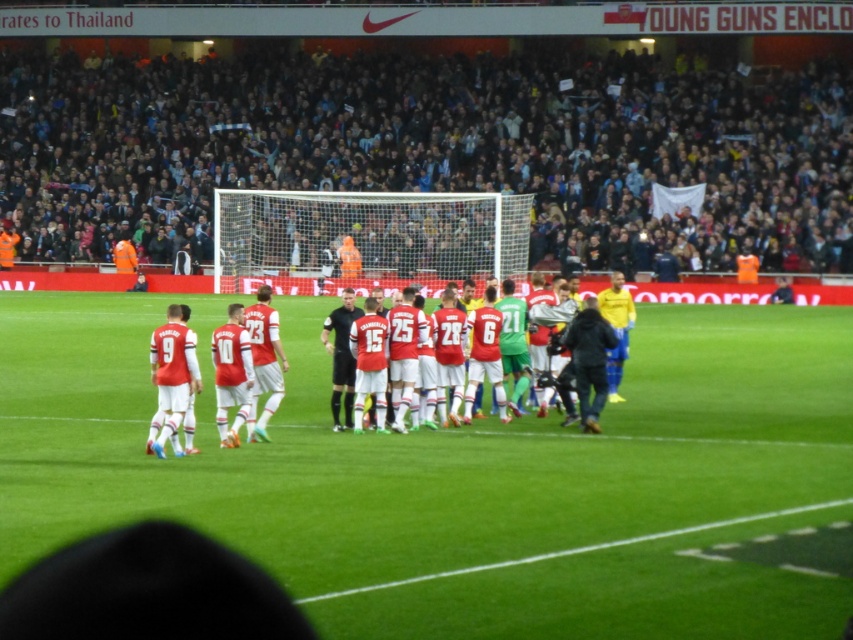
You are a drone operator trying to capture a shot of the soccer field. The dark gray crowd at upper center and the green grass at center are both in your view. Which area should you focus on to ensure the camera can capture more width?

The dark gray crowd at upper center might be wider than the green grass at center, so focusing on it would likely allow the camera to capture more width.